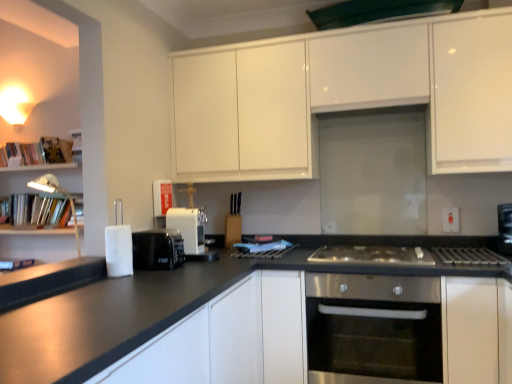
Question: Does white matte cabinet at center, arranged as the 3th cabinetry when viewed from the top, have a larger size compared to white plastic coffee machine at center?

Choices:
 (A) yes
 (B) no

Answer: (A)

Question: Is white matte cabinet at center, the first cabinetry from the bottom, positioned in front of white plastic coffee machine at center?

Choices:
 (A) no
 (B) yes

Answer: (B)

Question: Does white matte cabinet at center, the first cabinetry from the bottom, appear on the left side of white plastic coffee machine at center?

Choices:
 (A) yes
 (B) no

Answer: (B)

Question: Is white matte cabinet at center, arranged as the 3th cabinetry when viewed from the top, oriented towards white plastic coffee machine at center?

Choices:
 (A) yes
 (B) no

Answer: (B)

Question: Would you say white matte cabinet at center, arranged as the 3th cabinetry when viewed from the top, is outside white plastic coffee machine at center?

Choices:
 (A) yes
 (B) no

Answer: (A)

Question: Is white matte cabinet at center, the first cabinetry from the bottom, at the right side of white plastic coffee machine at center?

Choices:
 (A) yes
 (B) no

Answer: (A)

Question: Can we say green matte exhaust hood at upper center lies outside white plastic coffee machine at center?

Choices:
 (A) no
 (B) yes

Answer: (B)

Question: From the image's perspective, is green matte exhaust hood at upper center above white plastic coffee machine at center?

Choices:
 (A) yes
 (B) no

Answer: (A)

Question: Can you confirm if green matte exhaust hood at upper center is positioned to the right of white plastic coffee machine at center?

Choices:
 (A) yes
 (B) no

Answer: (A)

Question: Is white plastic coffee machine at center inside green matte exhaust hood at upper center?

Choices:
 (A) yes
 (B) no

Answer: (B)

Question: Is green matte exhaust hood at upper center positioned with its back to white plastic coffee machine at center?

Choices:
 (A) yes
 (B) no

Answer: (B)

Question: Does green matte exhaust hood at upper center appear on the left side of white plastic coffee machine at center?

Choices:
 (A) no
 (B) yes

Answer: (A)

Question: Is stainless steel oven at center taller than green matte exhaust hood at upper center?

Choices:
 (A) yes
 (B) no

Answer: (A)